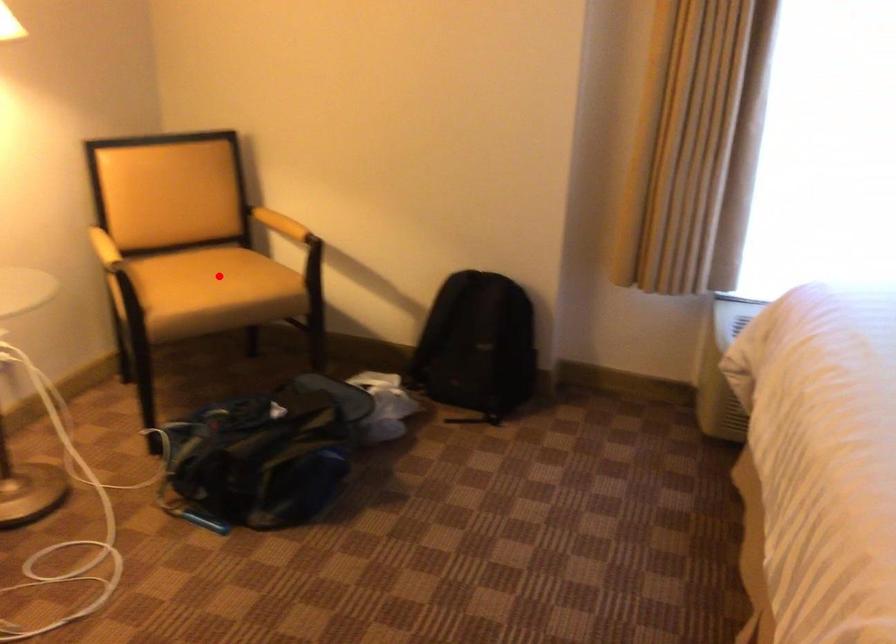
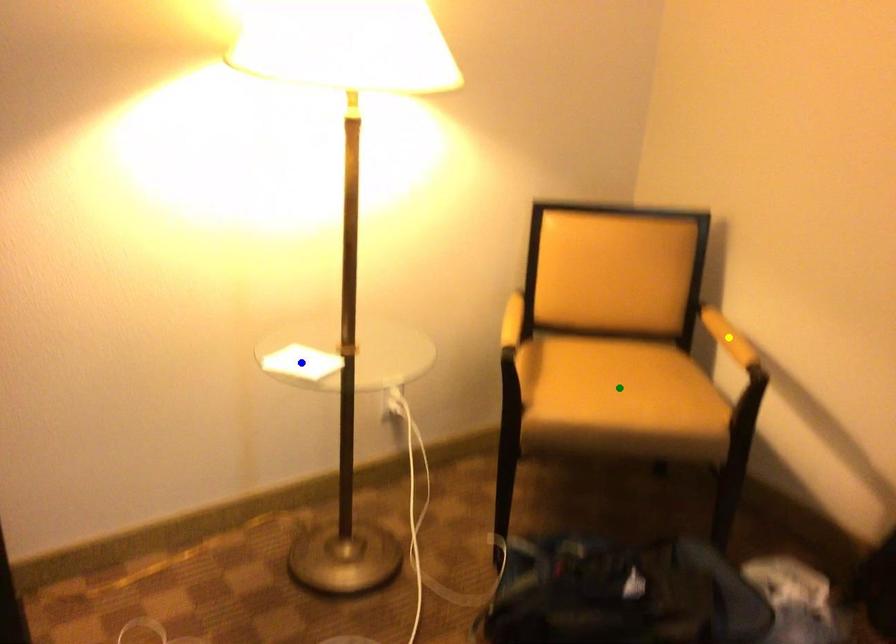
Question: I am providing you with two images of the same scene from different viewpoints. A red point is marked on the first image. You are given multiple points on the second image. In image 2, which mark is for the same physical point as the one in image 1?

Choices:
 (A) blue point
 (B) green point
 (C) yellow point

Answer: (B)